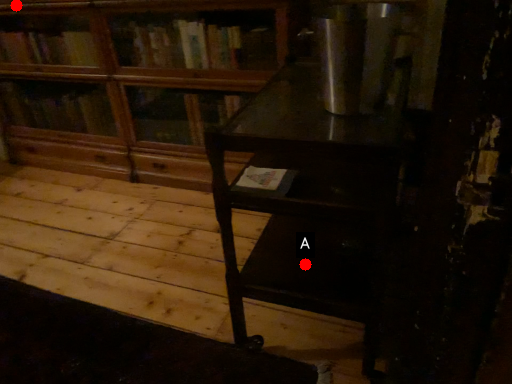
Question: Two points are circled on the image, labeled by A and B beside each circle. Which point appears farthest from the camera in this image?

Choices:
 (A) A is further
 (B) B is further

Answer: (B)